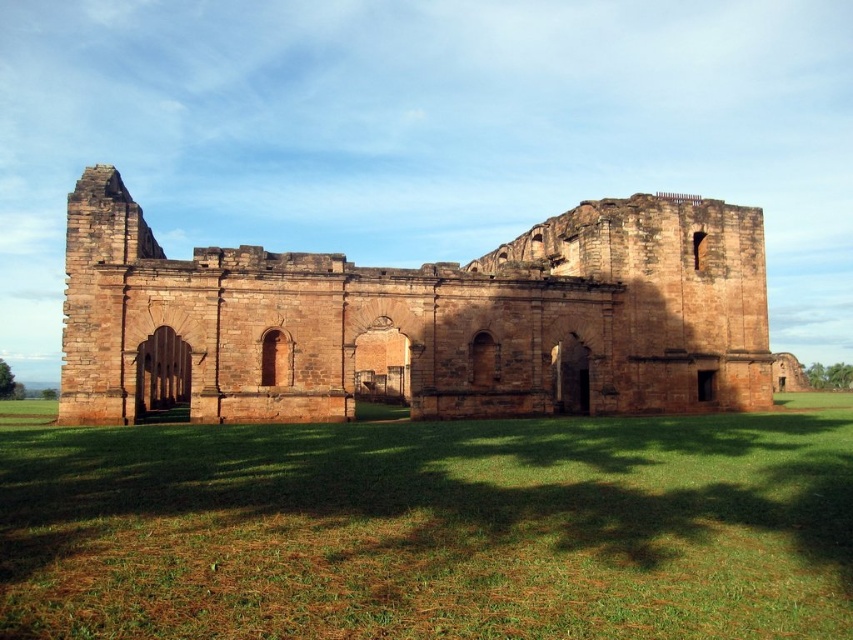
You are a landscape architect planning to install a small garden in the green grass at center and the brown stone ruins at center. Given the space constraints, which area can accommodate a wider garden bed?

The green grass at center has a larger width than the brown stone ruins at center, so it can accommodate a wider garden bed.

You are standing at the point marked as point (432, 529) in the image. Looking towards the historical stone structure, which direction would you face? The point is on green grass at center. Please choose from north, south, east, or west.

Since the point is on the green grass at center, facing the historical stone structure would mean facing north.